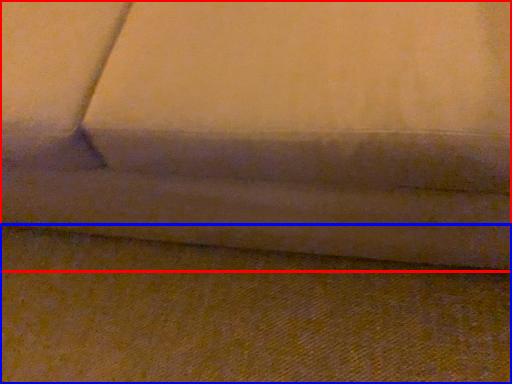
Question: Which object appears farthest to the camera in this image, studio couch (highlighted by a red box) or surface (highlighted by a blue box)?

Choices:
 (A) studio couch
 (B) surface

Answer: (B)